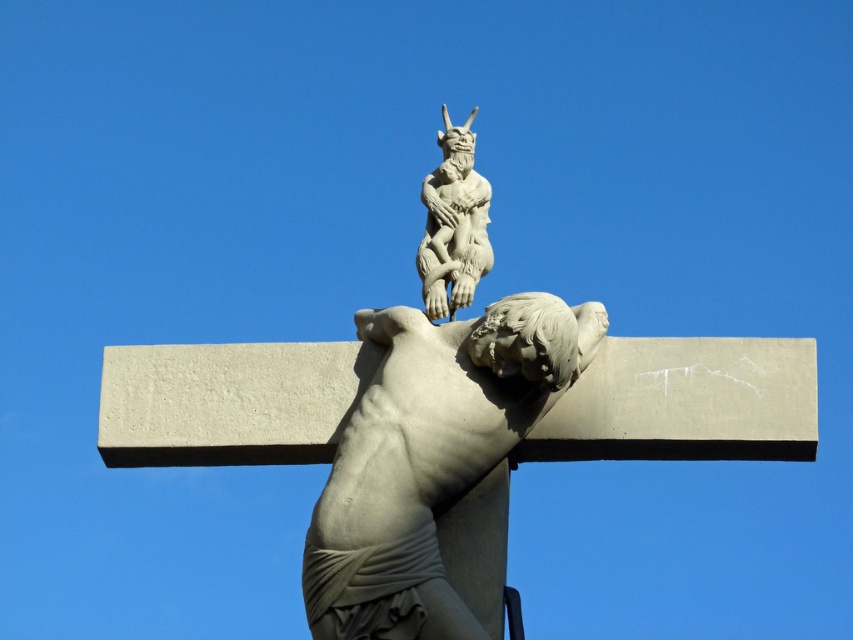
Does point (521, 365) come farther from viewer compared to point (467, 161)?

No, it is not.

How far apart are white stone cross at center and white stone gargoyle at upper center?

white stone cross at center is 11.12 meters from white stone gargoyle at upper center.

Who is more distant from viewer, (548, 296) or (463, 292)?

The point (463, 292) is more distant.

Locate an element on the screen. The height and width of the screenshot is (640, 853). white stone cross at center is located at coordinates (447, 435).

What do you see at coordinates (447, 435) in the screenshot? This screenshot has width=853, height=640. I see `white stone cross at center` at bounding box center [447, 435].

Based on the photo, between white stone cross at center and white stone crucifix at center, which one appears on the left side from the viewer's perspective?

From the viewer's perspective, white stone cross at center appears more on the left side.

Which is in front, point (607, 342) or point (425, 566)?

Point (425, 566) is more forward.

You are a GUI agent. You are given a task and a screenshot of the screen. Output one action in this format:
    pyautogui.click(x=<x>, y=<y>)
    Task: Click on the white stone cross at center
    
    Given the screenshot: What is the action you would take?
    pyautogui.click(x=447, y=435)

From the picture: Does white stone crucifix at center appear on the right side of white stone gargoyle at upper center?

Answer: In fact, white stone crucifix at center is to the left of white stone gargoyle at upper center.

Between point (463, 456) and point (448, 257), which one is positioned behind?

Positioned behind is point (448, 257).

Where is `white stone crucifix at center`? white stone crucifix at center is located at coordinates 430,456.